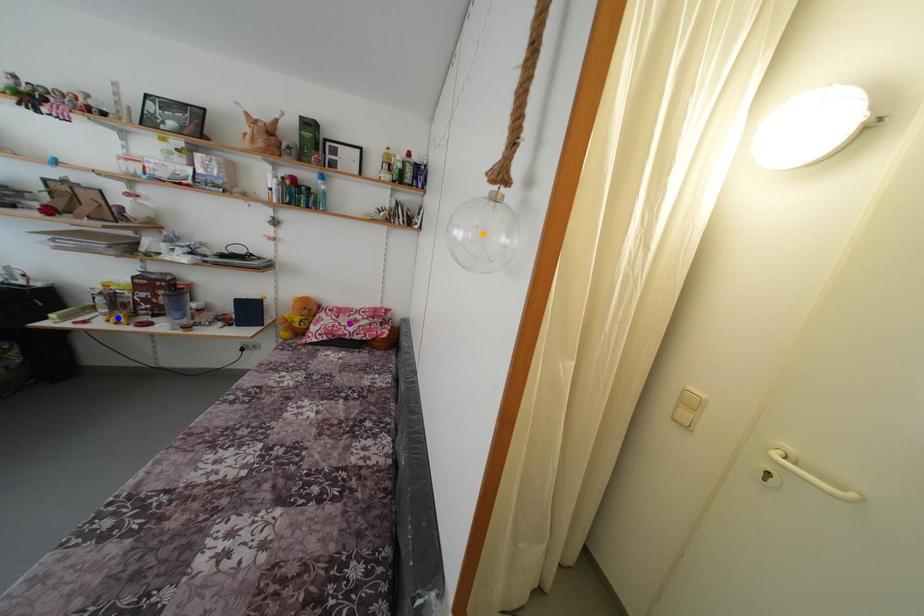
Order these from nearest to farthest:
blue point | orange point | purple point

orange point
blue point
purple point